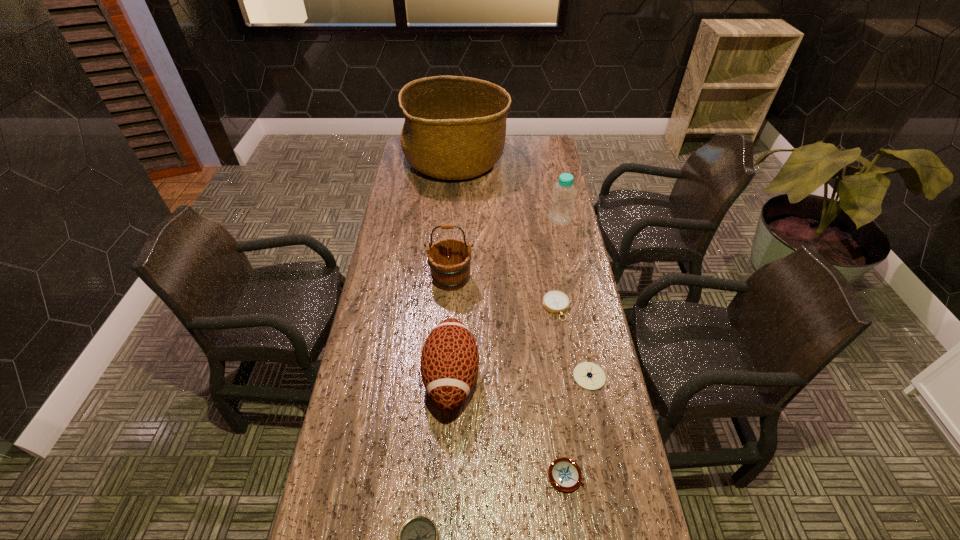
Locate an element on the screen. bottle present at the right edge is located at coordinates (562, 204).

Identify the location of object that is at the far left corner. (455, 127).

Where is `free space at the left edge of the desktop`? Image resolution: width=960 pixels, height=540 pixels. free space at the left edge of the desktop is located at coordinates (364, 341).

In the image, there is a desktop. At what (x,y) coordinates should I click in order to perform the action: click on free space at the right edge. Please return your answer as a coordinate pair (x, y). The width and height of the screenshot is (960, 540). Looking at the image, I should click on (527, 166).

I want to click on blank space at the far right corner, so click(x=530, y=141).

You are a GUI agent. You are given a task and a screenshot of the screen. Output one action in this format:
    pyautogui.click(x=<x>, y=<y>)
    Task: Click on the vacant area that lies between the sixth nearest object and the seventh farthest object
    The height and width of the screenshot is (540, 960).
    Given the screenshot: What is the action you would take?
    pyautogui.click(x=509, y=377)

Locate an element on the screen. vacant area that lies between the tallest object and the second nearest compass is located at coordinates (511, 318).

Where is `free space between the second farthest compass and the wine bucket`? free space between the second farthest compass and the wine bucket is located at coordinates (520, 327).

Locate an element on the screen. The width and height of the screenshot is (960, 540). vacant area that lies between the second nearest compass and the fourth farthest object is located at coordinates (562, 392).

What are the coordinates of `vacant space in between the second farthest object and the second farthest compass` in the screenshot? It's located at (574, 298).